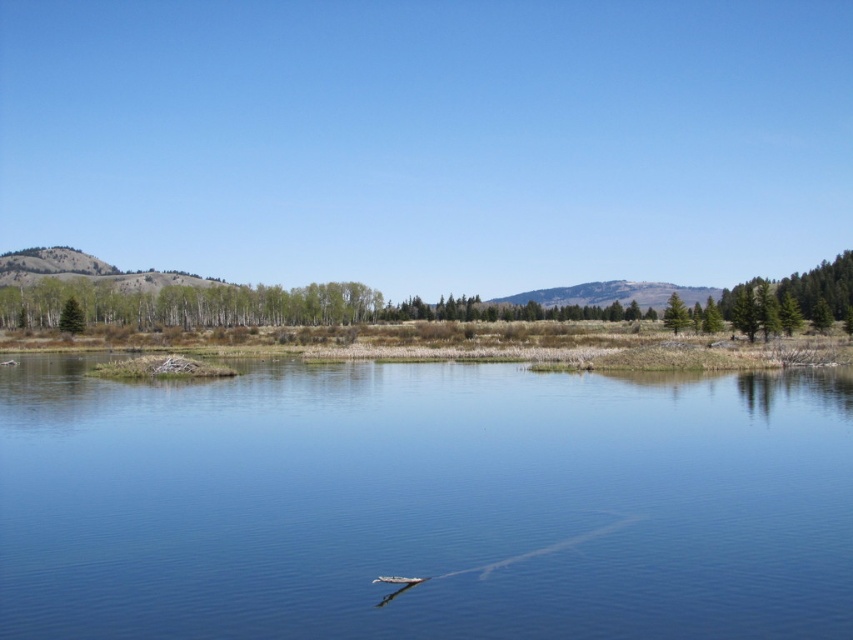
Is green textured tree at right above green matte tree at left?

Correct, green textured tree at right is located above green matte tree at left.

Is point (756, 316) closer to viewer compared to point (78, 330)?

That is True.

At what (x,y) coordinates should I click in order to perform the action: click on green textured tree at right. Please return your answer as a coordinate pair (x, y). Image resolution: width=853 pixels, height=640 pixels. Looking at the image, I should click on (788, 300).

Where is `green textured tree at right`? green textured tree at right is located at coordinates (788, 300).

Does clear water at center have a larger size compared to green textured tree at right?

Incorrect, clear water at center is not larger than green textured tree at right.

Who is more distant from viewer, (160, 442) or (778, 321)?

The point (778, 321) is behind.

Identify the location of clear water at center. This screenshot has height=640, width=853. (422, 504).

Locate an element on the screen. The image size is (853, 640). clear water at center is located at coordinates (422, 504).

Between clear water at center and green matte tree at left, which one appears on the left side from the viewer's perspective?

Positioned to the left is green matte tree at left.

Does clear water at center appear over green matte tree at left?

No, clear water at center is not above green matte tree at left.

Where is `clear water at center`? This screenshot has height=640, width=853. clear water at center is located at coordinates [x=422, y=504].

I want to click on clear water at center, so click(x=422, y=504).